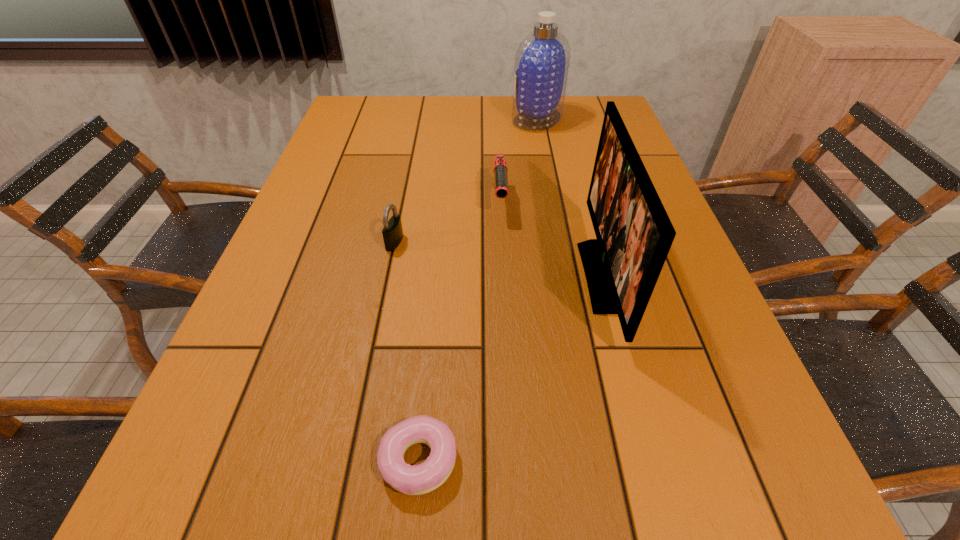
At what (x,y) coordinates should I click in order to perform the action: click on object that ranks as the third closest to the nearest object. Please return your answer as a coordinate pair (x, y). This screenshot has width=960, height=540. Looking at the image, I should click on (500, 169).

Locate an element on the screen. Image resolution: width=960 pixels, height=540 pixels. the fourth closest object to the third object from left to right is located at coordinates (420, 479).

This screenshot has width=960, height=540. Find the location of `vacant space that satisfies the following two spatial constraints: 1. on the back side of the farthest object; 2. on the left side of the padlock`. vacant space that satisfies the following two spatial constraints: 1. on the back side of the farthest object; 2. on the left side of the padlock is located at coordinates tap(420, 119).

I want to click on free space in the image that satisfies the following two spatial constraints: 1. on the back side of the farthest object; 2. on the right side of the fourth object from right to left, so click(451, 119).

This screenshot has height=540, width=960. What are the coordinates of `free space that satisfies the following two spatial constraints: 1. on the back side of the farthest object; 2. on the left side of the shortest object` in the screenshot? It's located at (451, 119).

The height and width of the screenshot is (540, 960). What are the coordinates of `vacant space that satisfies the following two spatial constraints: 1. on the back side of the doughnut; 2. on the left side of the farthest object` in the screenshot? It's located at (451, 119).